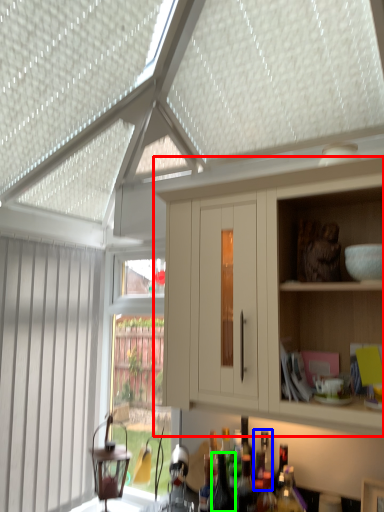
Question: Which object is positioned farthest from cabinetry (highlighted by a red box)? Select from bottle (highlighted by a blue box) and bottle (highlighted by a green box).

Choices:
 (A) bottle
 (B) bottle

Answer: (B)